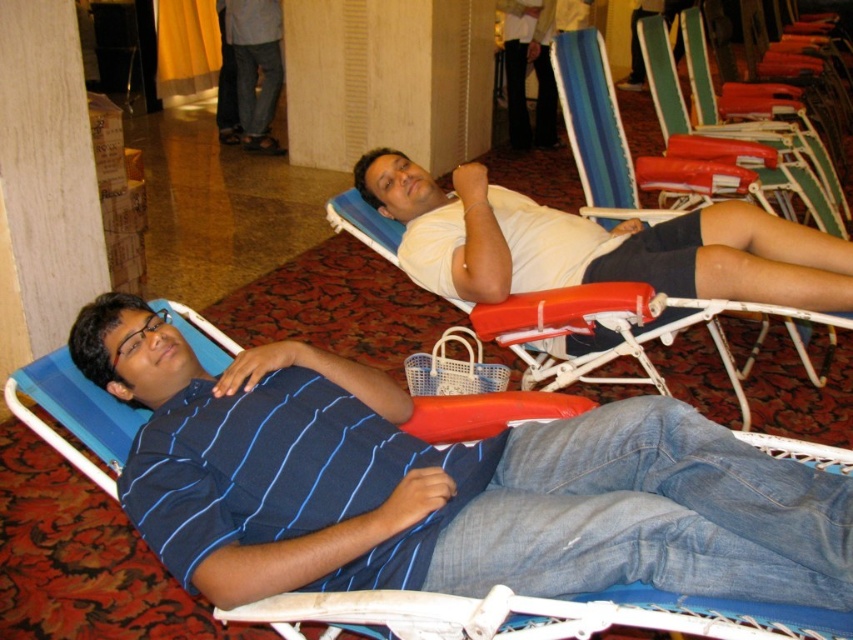
Question: Does blue striped shirt at left come in front of red plastic beach chair at center?

Choices:
 (A) no
 (B) yes

Answer: (B)

Question: Based on their relative distances, which object is nearer to the blue striped shirt at left?

Choices:
 (A) red plastic beach chair at center
 (B) white matte shirt at upper center
 (C) orange plastic beach chair at center

Answer: (B)

Question: Does blue striped shirt at left appear on the right side of orange plastic beach chair at center?

Choices:
 (A) no
 (B) yes

Answer: (A)

Question: Which point appears farthest from the camera in this image?

Choices:
 (A) (654, 48)
 (B) (469, 266)

Answer: (A)

Question: Which object appears farthest from the camera in this image?

Choices:
 (A) red plastic beach chair at center
 (B) white matte shirt at upper center

Answer: (A)

Question: Can you confirm if blue striped shirt at left is positioned below orange plastic beach chair at center?

Choices:
 (A) yes
 (B) no

Answer: (A)